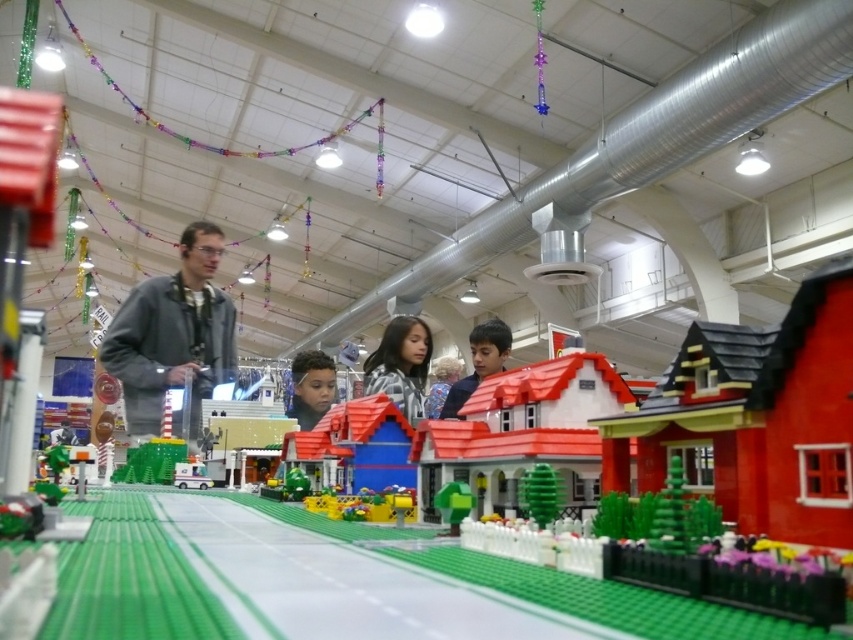
Question: Which of these objects is positioned farthest from the gray matte jacket at upper left?

Choices:
 (A) white plastic ambulance at center
 (B) matte black hair at center

Answer: (A)

Question: Can you confirm if matte black hair at center is thinner than white plastic ambulance at center?

Choices:
 (A) yes
 (B) no

Answer: (B)

Question: Which of the following is the closest to the observer?

Choices:
 (A) (328, 403)
 (B) (397, 404)
 (C) (456, 380)
 (D) (190, 476)

Answer: (D)

Question: Among these points, which one is farthest from the camera?

Choices:
 (A) (502, 349)
 (B) (140, 433)

Answer: (A)

Question: Is smooth brown hair at center bigger than white plastic ambulance at center?

Choices:
 (A) yes
 (B) no

Answer: (A)

Question: Is gray matte jacket at upper left to the right of white plastic ambulance at center from the viewer's perspective?

Choices:
 (A) yes
 (B) no

Answer: (B)